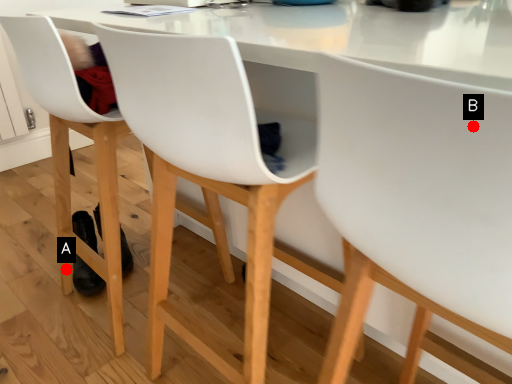
Question: Two points are circled on the image, labeled by A and B beside each circle. Which point is further to the camera?

Choices:
 (A) A is further
 (B) B is further

Answer: (A)